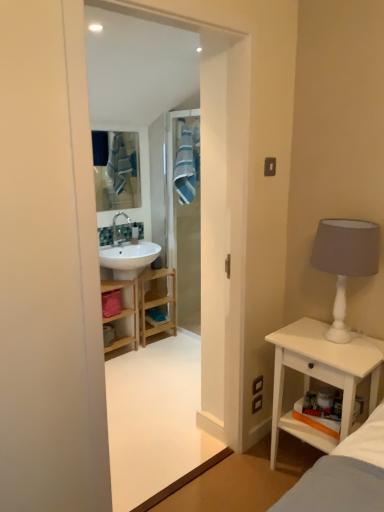
Where is `vacant region above white matte table lamp at right (from a real-world perspective)`? vacant region above white matte table lamp at right (from a real-world perspective) is located at coordinates (344, 223).